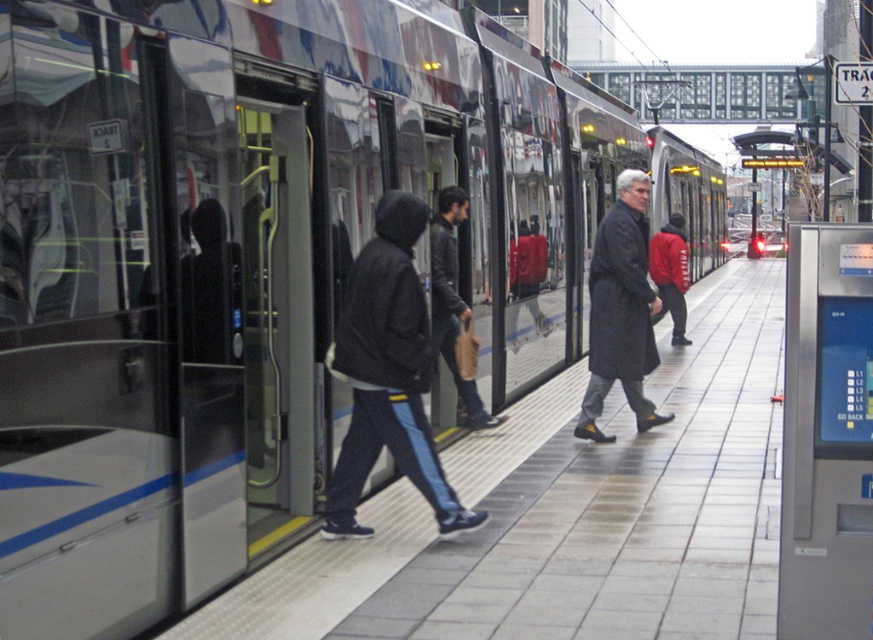
You are standing on the train station platform and want to find the dark gray coat at center. Based on the coordinates provided, where would you look relative to the platform?

The dark gray coat at center is located at coordinates point [620,310], which places it near the center of the platform.

You are standing on the train platform and see a person wearing dark blue jeans at center and another person wearing dark gray coat at center. Which person is shorter?

The dark blue jeans at center is not as tall as dark gray coat at center, so the person wearing dark blue jeans at center is shorter.

You are standing at the train station platform and want to know which of the two points, point (595,268) or point (432,305), is closer to you. Can you determine this based on their positions?

Point (595,268) is further to the viewer than point (432,305), so point (432,305) is closer to you.